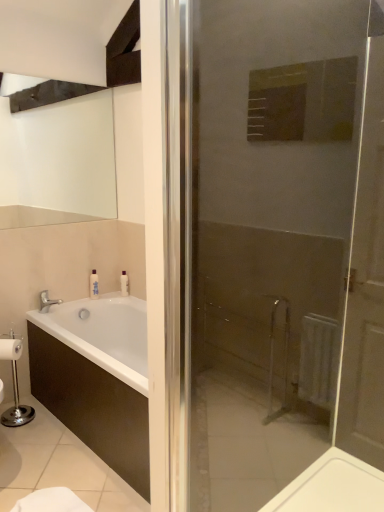
This screenshot has height=512, width=384. Find the location of `free location in front of silver metallic faucet at lower left`. free location in front of silver metallic faucet at lower left is located at coordinates (43, 320).